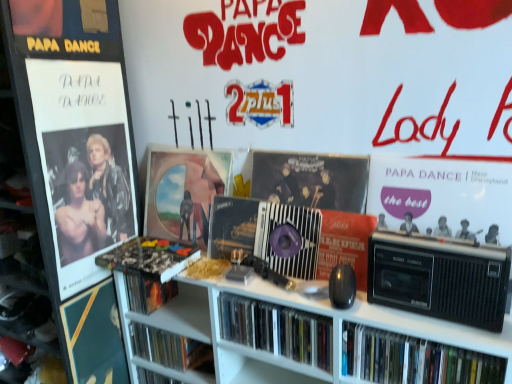
Question: Does metallic silver cassette at center, the 1th cassette positioned from the back, have a lesser width compared to white plastic bookcase at center?

Choices:
 (A) yes
 (B) no

Answer: (A)

Question: Does metallic silver cassette at center, the 1th cassette positioned from the back, have a greater height compared to white plastic bookcase at center?

Choices:
 (A) no
 (B) yes

Answer: (A)

Question: From a real-world perspective, is metallic silver cassette at center, which is the 2th cassette in right-to-left order, over white plastic bookcase at center?

Choices:
 (A) yes
 (B) no

Answer: (A)

Question: Can you confirm if metallic silver cassette at center, which appears as the 2th cassette when viewed from the front, is wider than white plastic bookcase at center?

Choices:
 (A) no
 (B) yes

Answer: (A)

Question: Is white plastic bookcase at center a part of metallic silver cassette at center, which appears as the 2th cassette when viewed from the front?

Choices:
 (A) no
 (B) yes

Answer: (A)

Question: Is metallic silver cassette at center, which is the 2th cassette in right-to-left order, behind white plastic bookcase at center?

Choices:
 (A) no
 (B) yes

Answer: (B)

Question: Is matte black record player at right shorter than camouflage-patterned book at center, arranged as the 2th book when viewed from the left?

Choices:
 (A) no
 (B) yes

Answer: (A)

Question: Can you confirm if matte black record player at right is smaller than camouflage-patterned book at center, arranged as the 2th book when viewed from the left?

Choices:
 (A) yes
 (B) no

Answer: (B)

Question: Considering the relative sizes of matte black record player at right and camouflage-patterned book at center, placed as the third book when sorted from right to left, in the image provided, is matte black record player at right thinner than camouflage-patterned book at center, placed as the third book when sorted from right to left,?

Choices:
 (A) yes
 (B) no

Answer: (A)

Question: Is matte black record player at right wider than camouflage-patterned book at center, placed as the third book when sorted from right to left?

Choices:
 (A) no
 (B) yes

Answer: (A)

Question: Does matte black record player at right come behind camouflage-patterned book at center, placed as the third book when sorted from right to left?

Choices:
 (A) yes
 (B) no

Answer: (B)

Question: Would you say camouflage-patterned book at center, placed as the third book when sorted from right to left, is part of matte black record player at right's contents?

Choices:
 (A) yes
 (B) no

Answer: (B)

Question: From a real-world perspective, is matte black book at center, placed as the fourth book when sorted from right to left, beneath metallic glossy poster at left?

Choices:
 (A) yes
 (B) no

Answer: (A)